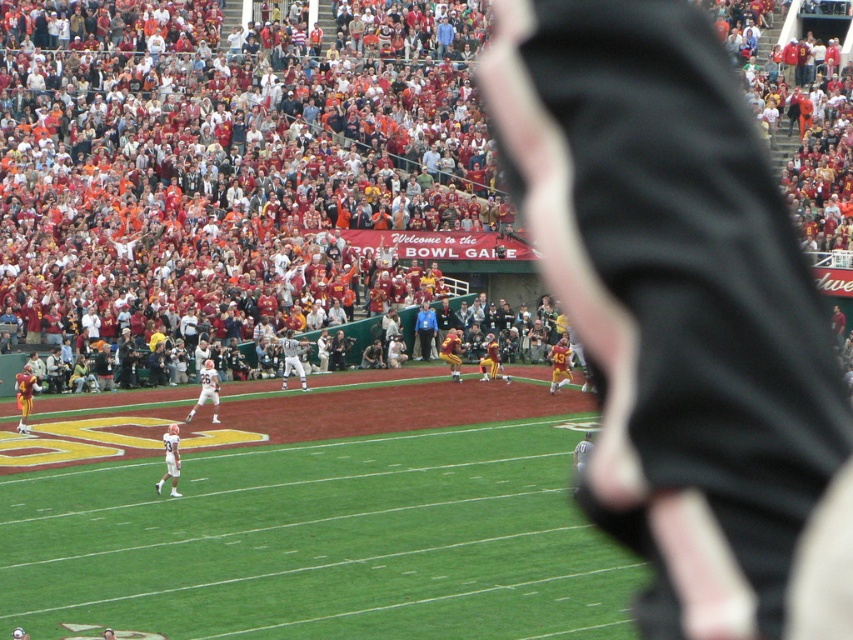
You are a photographer trying to capture the excitement of the BOWL GAME. You want to focus on the red fabric crowd at upper center. Where should you aim your camera based on the coordinates provided?

The red fabric crowd at upper center is located at coordinates point (235, 184), so you should aim your camera at that position to capture them.

You are a photographer standing at the edge of the field. You want to capture a photo that includes both the red fabric crowd at upper center and the green grass football field at center. Which object will appear larger in the photo?

The red fabric crowd at upper center will appear larger in the photo because it is taller than the green grass football field at center.

You are a photographer trying to capture a photo of the green grass football field at center and the yellow jersey at lower right. Since you want both objects to appear equally prominent in the photo, which one should you zoom in on more?

The green grass football field at center is larger than the yellow jersey at lower right, so you should zoom in more on the yellow jersey at lower right to make them appear equally prominent.